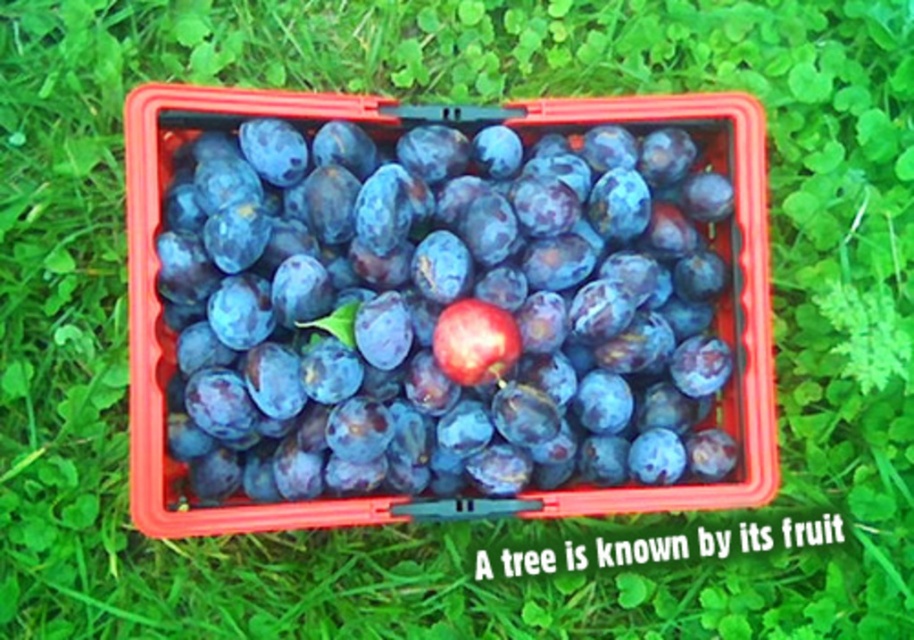
Question: Can you confirm if shiny purple plum at center is positioned above shiny red plum at center?

Choices:
 (A) no
 (B) yes

Answer: (B)

Question: Which point is farther from the camera taking this photo?

Choices:
 (A) (238, 252)
 (B) (459, 310)

Answer: (A)

Question: Does shiny purple plum at center have a lesser width compared to shiny red plum at center?

Choices:
 (A) no
 (B) yes

Answer: (A)

Question: Is shiny purple plum at center wider than shiny red plum at center?

Choices:
 (A) yes
 (B) no

Answer: (A)

Question: Which of the following is the farthest from the observer?

Choices:
 (A) (449, 360)
 (B) (272, 285)

Answer: (B)